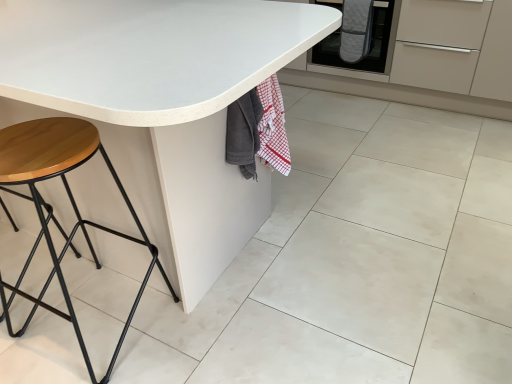
I want to click on empty space that is to the right of wooden/matte stool at left, so click(x=208, y=327).